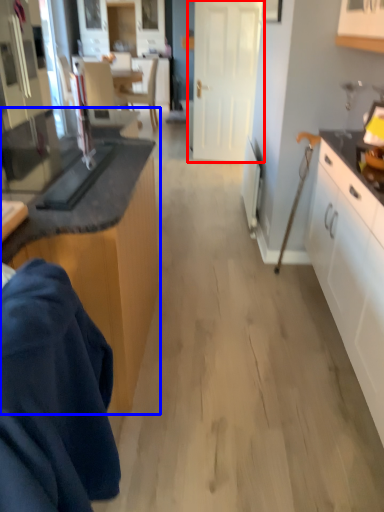
Question: Which of the following is the closest to the observer, door (highlighted by a red box) or cabinetry (highlighted by a blue box)?

Choices:
 (A) door
 (B) cabinetry

Answer: (B)